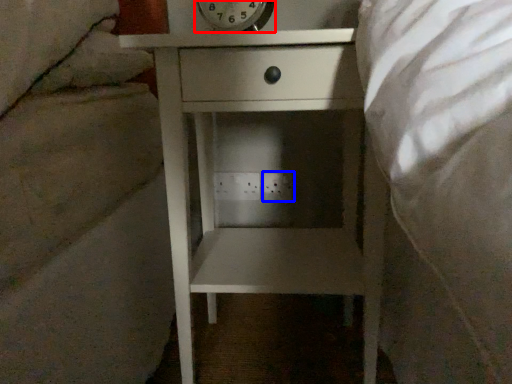
Question: Which point is closer to the camera, alarm clock (highlighted by a red box) or electric outlet (highlighted by a blue box)?

Choices:
 (A) alarm clock
 (B) electric outlet

Answer: (A)